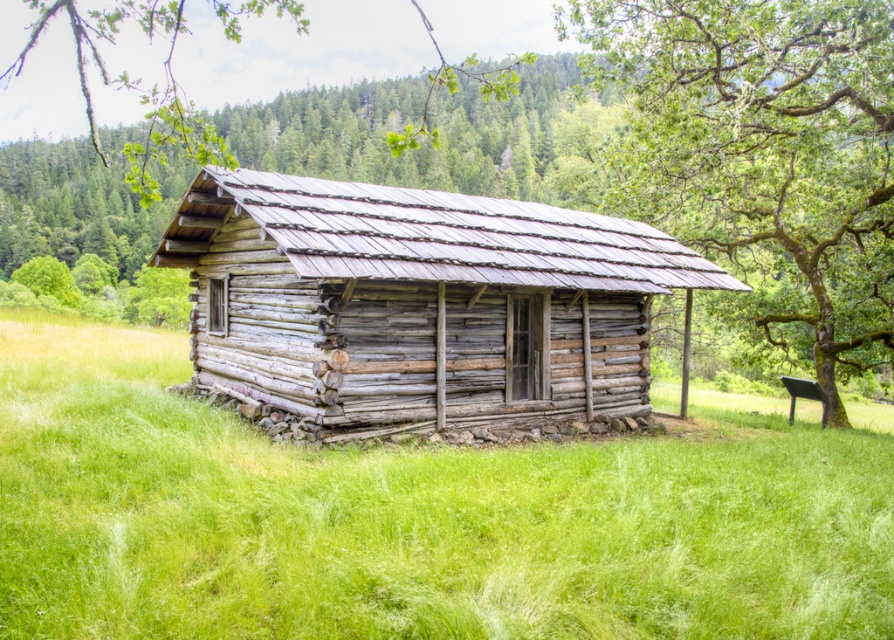
You are standing in front of the rustic log cabin and notice the green grassy field at center and the green leafy tree at upper center. Which of these two objects appears larger in the image?

The green leafy tree at upper center appears larger than the green grassy field at center.

You are standing in front of the weathered wood cabin at center and looking towards the green leafy tree at upper center. Can you see the entire cabin through the tree?

The green leafy tree at upper center is in front of the weathered wood cabin at center, so the tree would block part of the cabin from view.

You are standing in front of the rustic log cabin and want to determine the position of two points marked on the cabin wall. The first point is at coordinate point (129,390) and the second is at point (808,339). Which point is closer to your viewpoint?

Point (129,390) is closer to the camera than point (808,339).